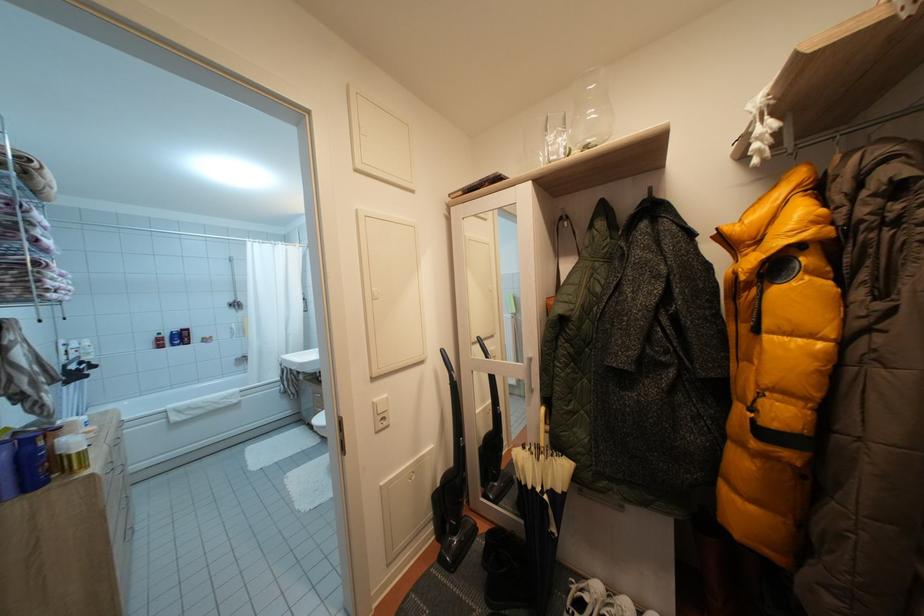
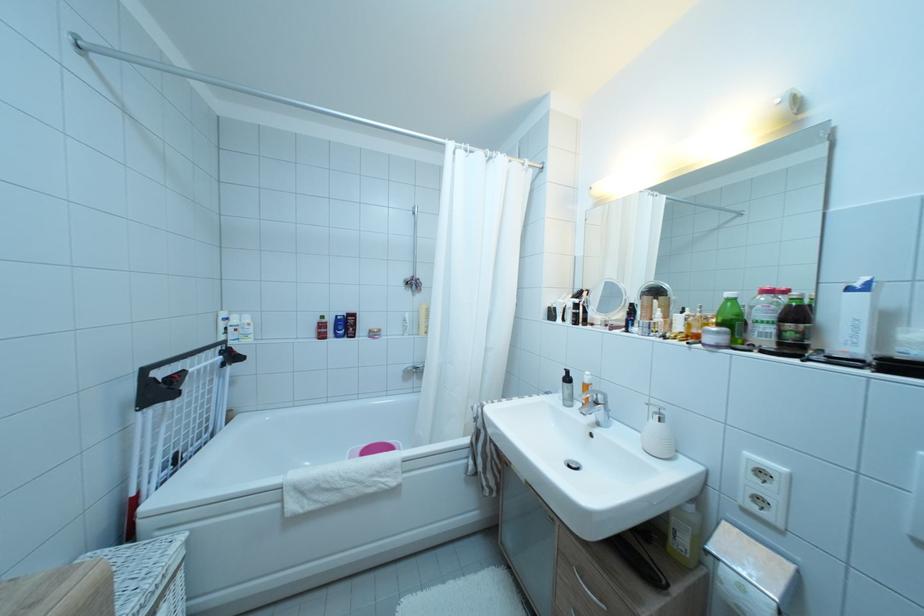
The point at (163,342) is marked in the first image. Where is the corresponding point in the second image?

(324, 325)